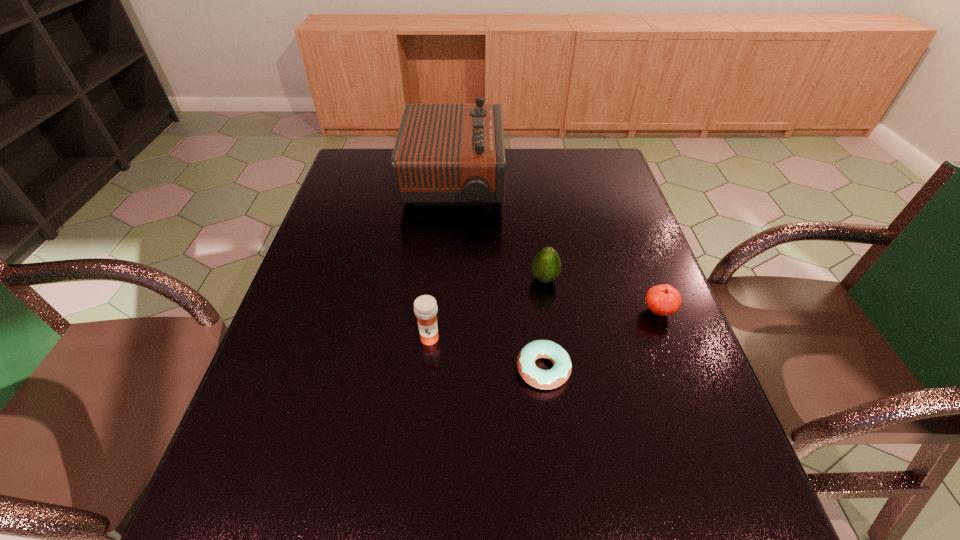
Image resolution: width=960 pixels, height=540 pixels. Identify the location of blank space located 0.290m on the left of the fourth tallest object. (518, 312).

The height and width of the screenshot is (540, 960). I want to click on vacant space situated on the left of the doughnut, so click(x=364, y=369).

Image resolution: width=960 pixels, height=540 pixels. What are the coordinates of `object present at the far edge` in the screenshot? It's located at (445, 154).

What are the coordinates of `object present at the right edge` in the screenshot? It's located at (663, 300).

At what (x,y) coordinates should I click in order to perform the action: click on free space at the far edge of the desktop. Please return your answer as a coordinate pair (x, y). This screenshot has height=540, width=960. Looking at the image, I should click on (567, 174).

The image size is (960, 540). What are the coordinates of `vacant space at the near edge of the desktop` in the screenshot? It's located at (306, 507).

Find the location of `free space at the left edge of the desktop`. free space at the left edge of the desktop is located at coordinates (321, 233).

Where is `vacant space at the right edge`? Image resolution: width=960 pixels, height=540 pixels. vacant space at the right edge is located at coordinates (614, 279).

You are a GUI agent. You are given a task and a screenshot of the screen. Output one action in this format:
    pyautogui.click(x=<x>, y=<y>)
    Task: Click on the vacant space at the near right corner of the desktop
    
    Given the screenshot: What is the action you would take?
    pyautogui.click(x=686, y=523)

You are a GUI agent. You are given a task and a screenshot of the screen. Output one action in this format:
    pyautogui.click(x=<x>, y=<y>)
    Task: Click on the unoccupied area between the rightmost object and the fourth nearest object
    
    Given the screenshot: What is the action you would take?
    pyautogui.click(x=602, y=295)